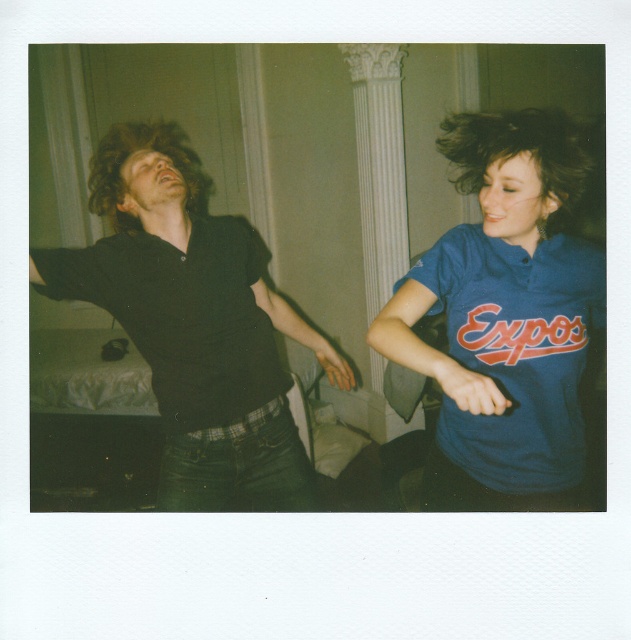
Between point (439, 285) and point (546, 186), which one is positioned in front?

Point (546, 186)

Between point (540, 371) and point (485, 125), which one is positioned behind?

Positioned behind is point (485, 125).

At what (x,y) coordinates should I click in order to perform the action: click on blue jersey at center. Please return your answer as a coordinate pair (x, y). Looking at the image, I should click on (505, 317).

Does blue jersey at center appear on the right side of matte black shirt at left?

Indeed, blue jersey at center is positioned on the right side of matte black shirt at left.

How much distance is there between blue jersey at center and matte black shirt at left?

They are 24.86 inches apart.

Between point (526, 289) and point (271, 392), which one is positioned in front?

Point (526, 289) is more forward.

Where is `blue jersey at center`? blue jersey at center is located at coordinates (505, 317).

Is dark brown silky hair at upper right to the left of curly brown hair at left from the viewer's perspective?

Incorrect, dark brown silky hair at upper right is not on the left side of curly brown hair at left.

Which is in front, point (444, 145) or point (98, 209)?

Point (444, 145)

Which is behind, point (572, 204) or point (109, 188)?

Positioned behind is point (109, 188).

This screenshot has height=640, width=631. What are the coordinates of `dark brown silky hair at upper right` in the screenshot? It's located at (534, 161).